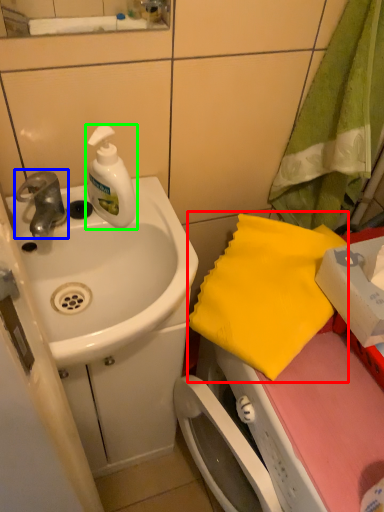
Question: Considering the real-world distances, which object is farthest from beach towel (highlighted by a red box)? tap (highlighted by a blue box) or soap dispenser (highlighted by a green box)?

Choices:
 (A) tap
 (B) soap dispenser

Answer: (A)